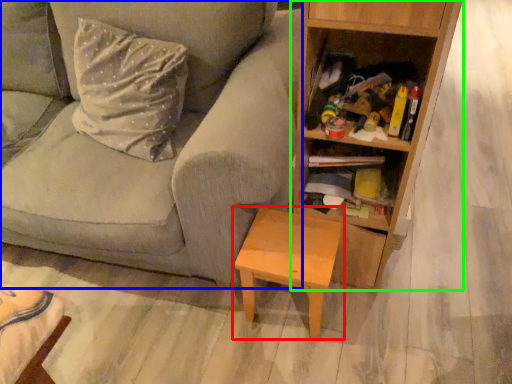
Question: Based on their relative distances, which object is farther from table (highlighted by a red box)? Choose from studio couch (highlighted by a blue box) and bookcase (highlighted by a green box).

Choices:
 (A) studio couch
 (B) bookcase

Answer: (A)